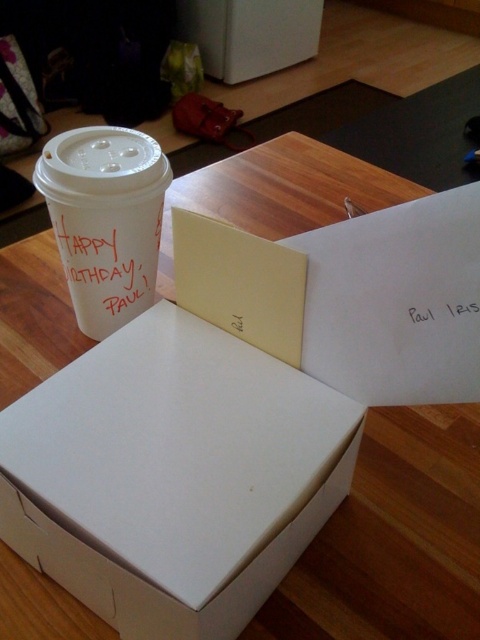
In the scene shown: You are a guest at a birthday party and see the white paper cup at upper left and the white paper at upper center on the table. Which item is taller?

The white paper cup at upper left is much taller than the white paper at upper center.

You are organizing a birthday party and need to arrange decorations. You have a white paper at upper center and a black paper at upper right. Where should you place a new decoration so it is between them?

Place the new decoration between the white paper at upper center and the black paper at upper right, since the white paper is above the black paper, the decoration should go in the space between them vertically.